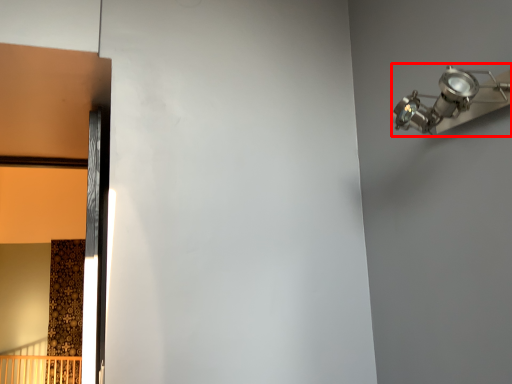
Question: Observing the image, what is the correct spatial positioning of light fixture (annotated by the red box) in reference to door?

Choices:
 (A) left
 (B) right

Answer: (B)